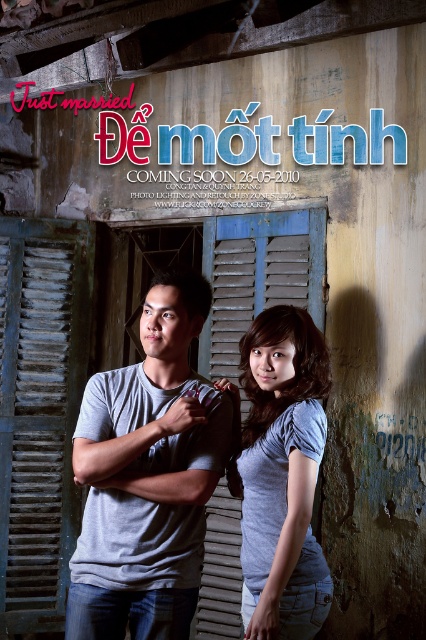
Question: Is gray cotton t-shirt at center thinner than light blue fabric shirt at center?

Choices:
 (A) yes
 (B) no

Answer: (B)

Question: Is the position of gray cotton t-shirt at center more distant than that of light blue fabric shirt at center?

Choices:
 (A) no
 (B) yes

Answer: (B)

Question: Among these objects, which one is nearest to the camera?

Choices:
 (A) light blue fabric shirt at center
 (B) gray cotton t-shirt at center

Answer: (A)

Question: Which point appears closest to the camera in this image?

Choices:
 (A) (308, 467)
 (B) (94, 548)

Answer: (B)

Question: Is gray cotton t-shirt at center smaller than light blue fabric shirt at center?

Choices:
 (A) no
 (B) yes

Answer: (B)

Question: Which object appears closest to the camera in this image?

Choices:
 (A) gray cotton t-shirt at center
 (B) light blue fabric shirt at center

Answer: (B)